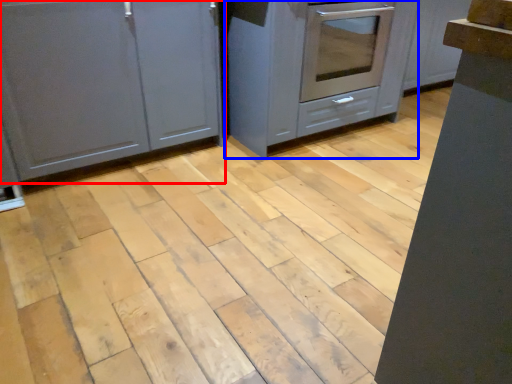
Question: Which object appears farthest to the camera in this image, cabinetry (highlighted by a red box) or cabinetry (highlighted by a blue box)?

Choices:
 (A) cabinetry
 (B) cabinetry

Answer: (B)